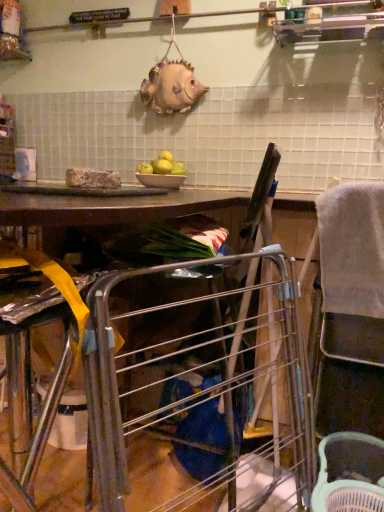
Question: Considering the positions of point (163, 187) and point (322, 501), is point (163, 187) closer or farther from the camera than point (322, 501)?

Choices:
 (A) closer
 (B) farther

Answer: (B)

Question: From the image's perspective, is white glossy bowl at center positioned above or below white plastic basket at lower right?

Choices:
 (A) below
 (B) above

Answer: (B)

Question: Which object is positioned farthest from the white glossy bowl at center?

Choices:
 (A) green matte apples at center
 (B) gray fabric feeding chair at right
 (C) metallic silver workbench at center
 (D) white plastic basket at lower right

Answer: (D)

Question: Which is nearer to the gray fabric feeding chair at right?

Choices:
 (A) metallic silver workbench at center
 (B) green matte apples at center
 (C) white glossy bowl at center
 (D) white plastic basket at lower right

Answer: (D)